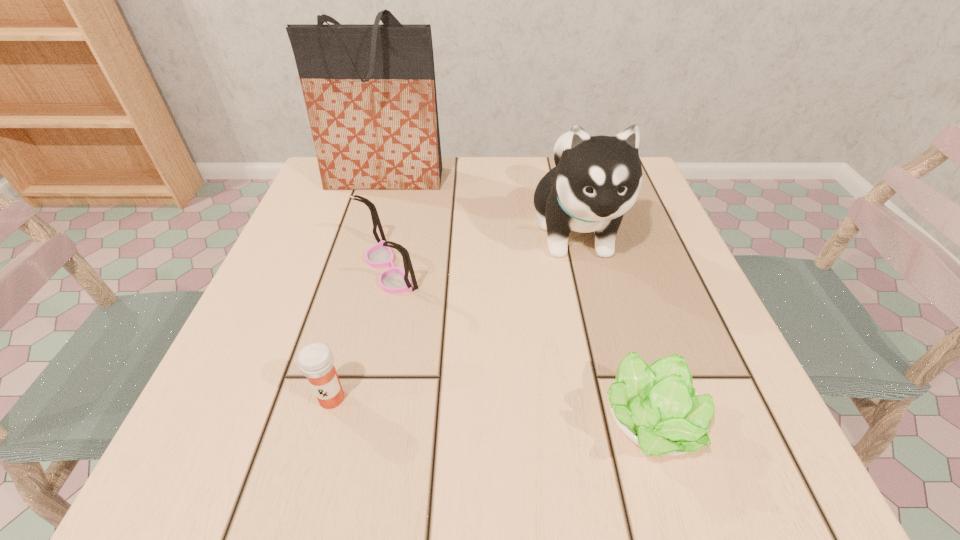
Where is `shopping bag situated at the far edge`? The image size is (960, 540). shopping bag situated at the far edge is located at coordinates (370, 93).

Image resolution: width=960 pixels, height=540 pixels. What are the coordinates of `puppy present at the far edge` in the screenshot? It's located at (597, 179).

Locate an element on the screen. object that is at the near edge is located at coordinates (656, 406).

Where is `shopping bag that is positioned at the left edge`? The image size is (960, 540). shopping bag that is positioned at the left edge is located at coordinates (370, 93).

Where is `spectacles at the left edge`? Image resolution: width=960 pixels, height=540 pixels. spectacles at the left edge is located at coordinates click(394, 280).

This screenshot has height=540, width=960. I want to click on medicine located at the left edge, so click(x=316, y=362).

Locate an element on the screen. puppy that is at the right edge is located at coordinates (597, 179).

The width and height of the screenshot is (960, 540). What are the coordinates of `lettuce situated at the right edge` in the screenshot? It's located at (656, 406).

Identify the location of object located at the far left corner. tap(370, 93).

Where is `object situated at the far right corner`? object situated at the far right corner is located at coordinates pos(597,179).